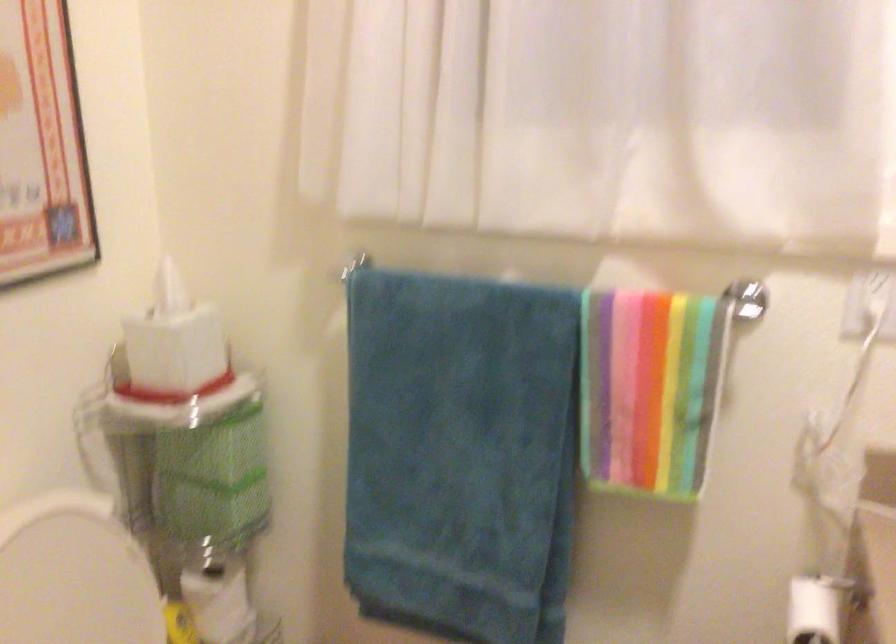
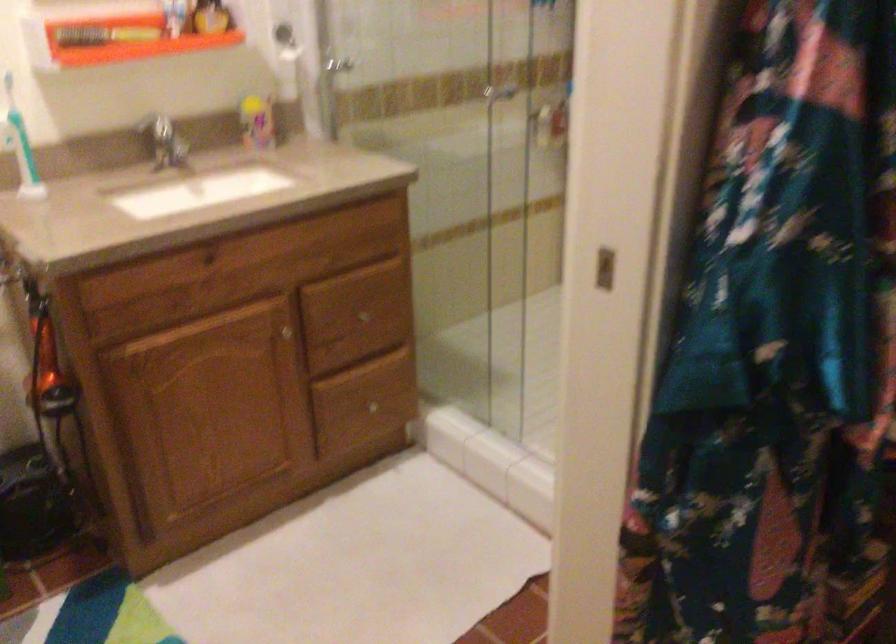
Based on the continuous images, in which direction is the camera rotating?

The rotation direction of the camera is right-down.